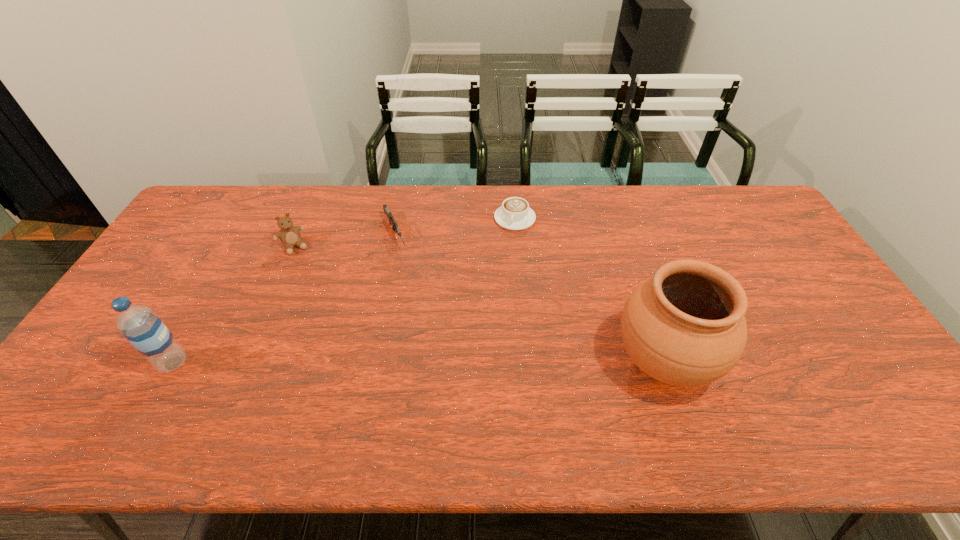
Where is `pottery located in the near edge section of the desktop`? pottery located in the near edge section of the desktop is located at coordinates (685, 326).

Identify the location of vacant position at the far edge of the desktop. coord(303,219).

Locate an element on the screen. The width and height of the screenshot is (960, 540). free space at the near edge of the desktop is located at coordinates 740,376.

This screenshot has width=960, height=540. What are the coordinates of `vacant region at the right edge of the desktop` in the screenshot? It's located at (864, 346).

Find the location of a particular element. Image resolution: width=960 pixels, height=540 pixels. free space between the water bottle and the pottery is located at coordinates (419, 362).

This screenshot has height=540, width=960. Find the location of `empty location between the rightmost object and the third object from right to left`. empty location between the rightmost object and the third object from right to left is located at coordinates (529, 298).

Locate an element on the screen. The image size is (960, 540). free spot between the rightmost object and the fourth object from left to right is located at coordinates (588, 290).

At what (x,y) coordinates should I click in order to perform the action: click on vacant space in between the pottery and the teddy bear. Please return your answer as a coordinate pair (x, y). The image size is (960, 540). Looking at the image, I should click on (478, 304).

Identify the location of empty space that is in between the teddy bear and the second object from right to left. (404, 233).

Locate an element on the screen. The height and width of the screenshot is (540, 960). vacant area between the fourth object from right to left and the pottery is located at coordinates pos(478,304).